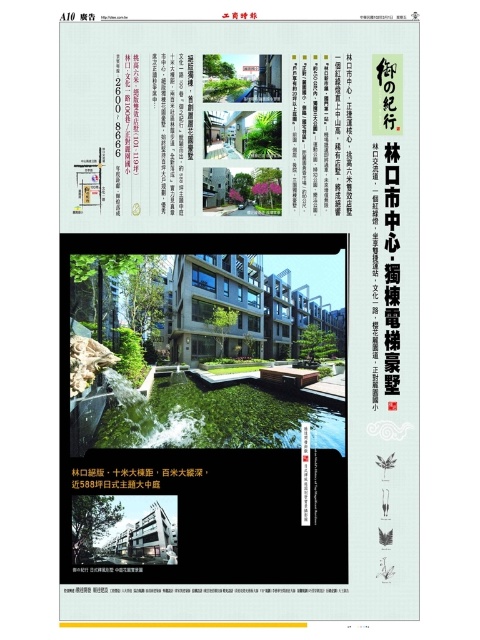
You are looking at a real estate advertisement page from the newspaper. You notice two pieces of paper on the top of the page. The black paper at upper left and the white paper at upper center. Which one is taller?

The black paper at upper left is taller than the white paper at upper center.

You are looking at the real estate advertisement page from the newspaper. There are two pieces of paper visible on the page. The black paper at upper left and the white paper at upper center. Which one is closer to you?

The black paper at upper left is closer to the viewer than the white paper at upper center.